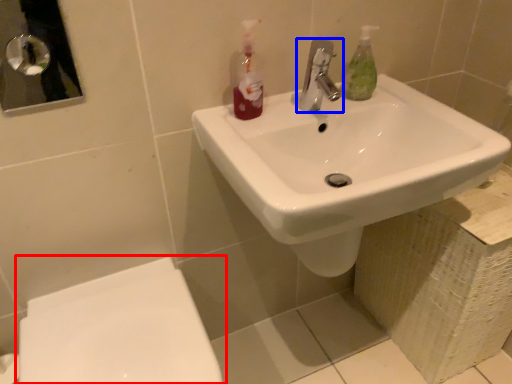
Question: Which point is closer to the camera, toilet (highlighted by a red box) or tap (highlighted by a blue box)?

Choices:
 (A) toilet
 (B) tap

Answer: (A)